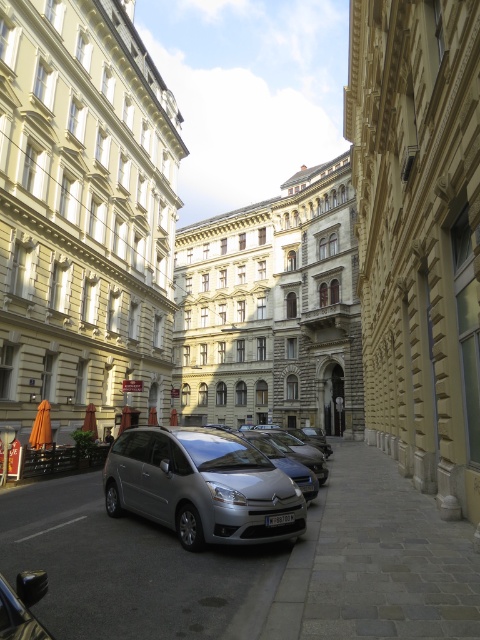
You are a delivery driver who needs to park your satin metallic car at center in the gray stone pavement at center. Is there enough space for the car to move into the pavement area without hitting the buildings or other cars?

The gray stone pavement at center is to the right of the satin metallic car at center. Since the pavement is positioned to the right of the car, there should be sufficient space for the car to maneuver into the pavement area without colliding with adjacent structures or vehicles.

You are standing on the gray stone pavement at center and want to walk to the satin metallic car at center. Which direction should you move to reach the car?

Since the gray stone pavement at center is closer to the viewer than the satin metallic car at center, you should move backward to reach the car.